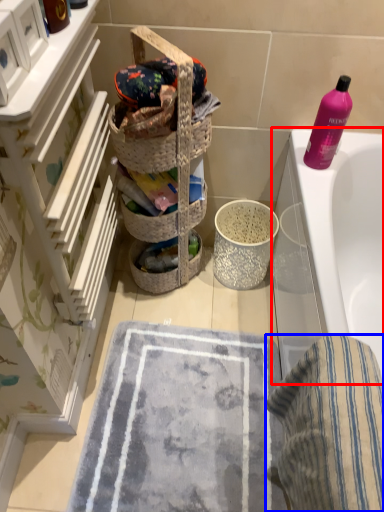
Question: Among these objects, which one is farthest to the camera, bathtub (highlighted by a red box) or beach towel (highlighted by a blue box)?

Choices:
 (A) bathtub
 (B) beach towel

Answer: (A)